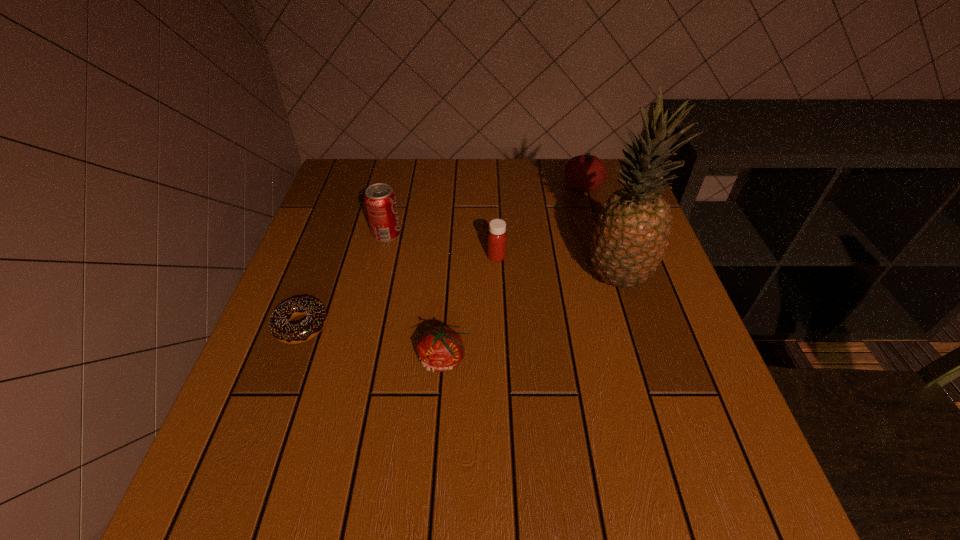
Identify the location of tomato at the right edge. This screenshot has height=540, width=960. (587, 172).

You are a GUI agent. You are given a task and a screenshot of the screen. Output one action in this format:
    pyautogui.click(x=<x>, y=<y>)
    Task: Click on the object positioned at the far right corner
    The image size is (960, 540).
    Given the screenshot: What is the action you would take?
    pyautogui.click(x=587, y=172)

Identify the location of blank space at the far edge. (478, 160).

I want to click on vacant space at the near edge, so click(475, 530).

This screenshot has height=540, width=960. I want to click on vacant space at the left edge of the desktop, so click(x=255, y=454).

This screenshot has height=540, width=960. Identify the location of blank space at the right edge of the desktop. (728, 409).

I want to click on vacant space at the far left corner of the desktop, so click(x=370, y=185).

This screenshot has height=540, width=960. Identify the location of vacant region at the far right corner of the desktop. (612, 183).

The width and height of the screenshot is (960, 540). Find the location of `vacant space at the near right corner`. vacant space at the near right corner is located at coordinates (755, 496).

Where is `vacant area that lies between the pineapple and the shortest object`? vacant area that lies between the pineapple and the shortest object is located at coordinates (459, 302).